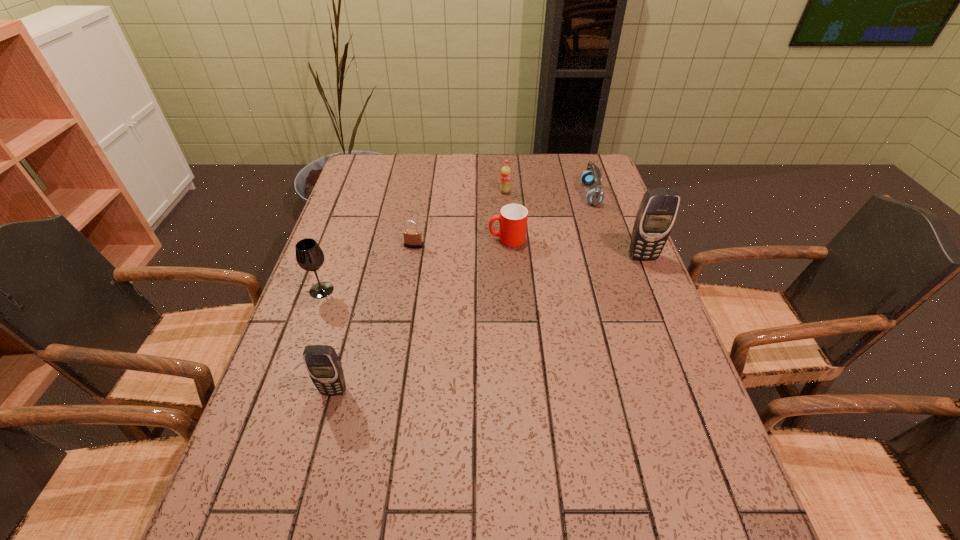
This screenshot has height=540, width=960. In order to click on vacant point at the right edge in this screenshot , I will do `click(597, 239)`.

Where is `vacant space at the far right corner`? vacant space at the far right corner is located at coordinates (578, 178).

I want to click on free space between the soda and the second object from right to left, so click(x=548, y=193).

The image size is (960, 540). Identify the location of vacant space that is in between the padlock and the third nearest object. (528, 251).

This screenshot has width=960, height=540. I want to click on free space that is in between the second object from right to left and the shorter cellular telephone, so click(x=462, y=293).

You are a GUI agent. You are given a task and a screenshot of the screen. Output one action in this format:
    pyautogui.click(x=<x>, y=<y>)
    Task: Click on the free space between the sixth farthest object and the taller cellular telephone
    
    Given the screenshot: What is the action you would take?
    pyautogui.click(x=482, y=273)

Find the location of a particular element. This screenshot has height=540, width=960. free space between the wineglass and the cup is located at coordinates (415, 265).

At what (x,y) coordinates should I click in order to perform the action: click on free space that is in between the left cellular telephone and the cup. Please return your answer as a coordinate pair (x, y). The image size is (960, 540). Looking at the image, I should click on (420, 315).

Identify the location of vacant area that lies between the second nearest object and the cup. The height and width of the screenshot is (540, 960). (415, 265).

This screenshot has width=960, height=540. Find the location of `vacant region between the second object from left to right and the headset`. vacant region between the second object from left to right and the headset is located at coordinates (462, 293).